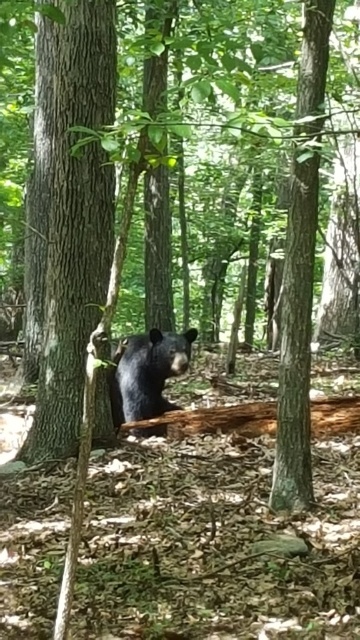
You are a wildlife photographer aiming to capture a clear shot of the black furry bear at center. Your camera is currently focused on point (146, 372). Is the black furry bear at center in focus?

The black furry bear at center is located at point (146, 372), so yes, the bear is in focus since the camera is focused on that point.

You are a wildlife photographer trying to capture a photo of the black furry bear at center. You notice the brown rough log at center is blocking part of the bear. Can you estimate whether the bear is bigger than the log in the photo?

The black furry bear at center is larger in size than the brown rough log at center, so yes, the bear is bigger than the log in the photo.

You are a hiker who wants to cross the forest floor. You see a smooth brown tree trunk at left and a brown rough log at center. Which object is closer to you?

The smooth brown tree trunk at left is positioned over the brown rough log at center, meaning it is closer to you.